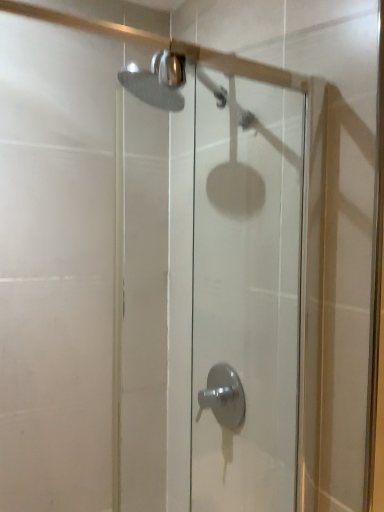
The height and width of the screenshot is (512, 384). What do you see at coordinates (224, 396) in the screenshot?
I see `satin nickel faucet at lower center` at bounding box center [224, 396].

I want to click on satin nickel faucet at lower center, so tap(224, 396).

Find the location of a particular element. The height and width of the screenshot is (512, 384). satin nickel faucet at lower center is located at coordinates (224, 396).